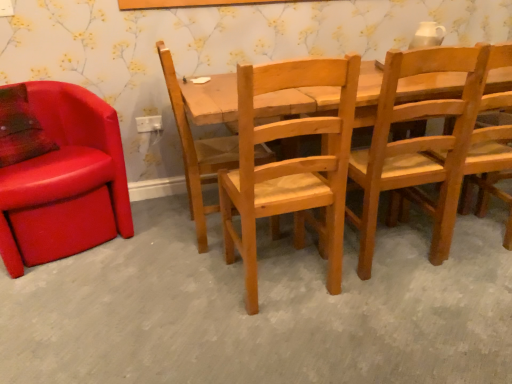
Question: Does leather at left, which is the fifth chair in right-to-left order, have a greater height compared to white plastic power outlet at center?

Choices:
 (A) yes
 (B) no

Answer: (A)

Question: Does leather at left, which is the fifth chair in right-to-left order, have a lesser width compared to white plastic power outlet at center?

Choices:
 (A) no
 (B) yes

Answer: (A)

Question: Is leather at left, which is the fifth chair in right-to-left order, closer to camera compared to white plastic power outlet at center?

Choices:
 (A) yes
 (B) no

Answer: (A)

Question: Is leather at left, which is the fifth chair in right-to-left order, surrounding white plastic power outlet at center?

Choices:
 (A) yes
 (B) no

Answer: (B)

Question: Is the position of leather at left, which is the fifth chair in right-to-left order, more distant than that of white plastic power outlet at center?

Choices:
 (A) no
 (B) yes

Answer: (A)

Question: Is leather at left, which appears as the 1th chair when viewed from the left, completely or partially outside of white plastic power outlet at center?

Choices:
 (A) no
 (B) yes

Answer: (B)

Question: Can you confirm if wooden chair at center, which is counted as the second chair, starting from the right, is smaller than wooden chair at lower center?

Choices:
 (A) yes
 (B) no

Answer: (A)

Question: Can you confirm if wooden chair at center, positioned as the fourth chair in left-to-right order, is positioned to the right of wooden chair at lower center?

Choices:
 (A) yes
 (B) no

Answer: (A)

Question: Could you tell me if wooden chair at center, which is counted as the second chair, starting from the right, is facing wooden chair at lower center?

Choices:
 (A) yes
 (B) no

Answer: (B)

Question: Considering the relative positions of wooden chair at center, which is counted as the second chair, starting from the right, and wooden chair at lower center in the image provided, is wooden chair at center, which is counted as the second chair, starting from the right, in front of wooden chair at lower center?

Choices:
 (A) no
 (B) yes

Answer: (A)

Question: From a real-world perspective, does wooden chair at center, which is counted as the second chair, starting from the right, stand above wooden chair at lower center?

Choices:
 (A) yes
 (B) no

Answer: (A)

Question: Does wooden chair at center, which is counted as the second chair, starting from the right, have a larger size compared to wooden chair at lower center?

Choices:
 (A) no
 (B) yes

Answer: (A)

Question: Is leather at left, which is the fifth chair in right-to-left order, directly adjacent to natural wood chair at center, which is the third chair in right-to-left order?

Choices:
 (A) yes
 (B) no

Answer: (B)